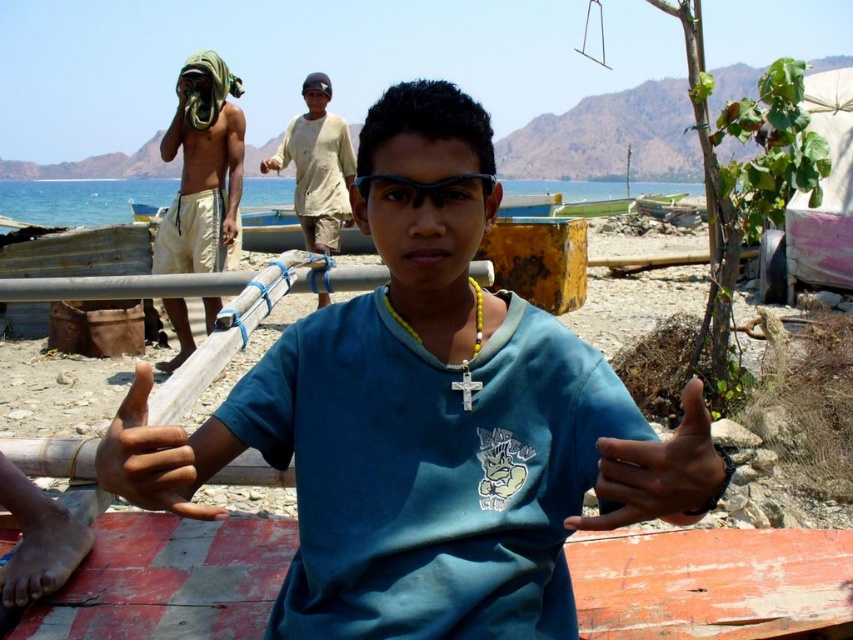
Does blue cotton shirt at center have a greater width compared to dark skin hand at center?

Correct, the width of blue cotton shirt at center exceeds that of dark skin hand at center.

Is blue cotton shirt at center above dark skin hand at center?

Yes.

Who is more distant from viewer, (398, 582) or (708, 438)?

Point (398, 582)

You are a GUI agent. You are given a task and a screenshot of the screen. Output one action in this format:
    pyautogui.click(x=<x>, y=<y>)
    Task: Click on the blue cotton shirt at center
    The image size is (853, 640).
    Given the screenshot: What is the action you would take?
    pyautogui.click(x=428, y=419)

Can you confirm if beige striped shorts at upper left is smaller than dark skin hand at center?

Incorrect, beige striped shorts at upper left is not smaller in size than dark skin hand at center.

Which is behind, point (206, 234) or point (708, 500)?

Positioned behind is point (206, 234).

Who is more forward, [201,93] or [647,461]?

Point [647,461]

The height and width of the screenshot is (640, 853). I want to click on beige striped shorts at upper left, so click(x=202, y=168).

Is blue cotton shirt at center above light beige cotton shirt at center?

No, blue cotton shirt at center is not above light beige cotton shirt at center.

Is blue cotton shirt at center closer to camera compared to light beige cotton shirt at center?

That is True.

Describe the element at coordinates (428, 419) in the screenshot. I see `blue cotton shirt at center` at that location.

Identify the location of blue cotton shirt at center. The height and width of the screenshot is (640, 853). (428, 419).